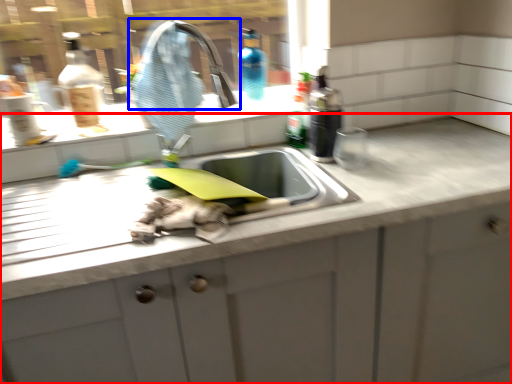
Question: Which point is closer to the camera, countertop (highlighted by a red box) or tap (highlighted by a blue box)?

Choices:
 (A) countertop
 (B) tap

Answer: (A)